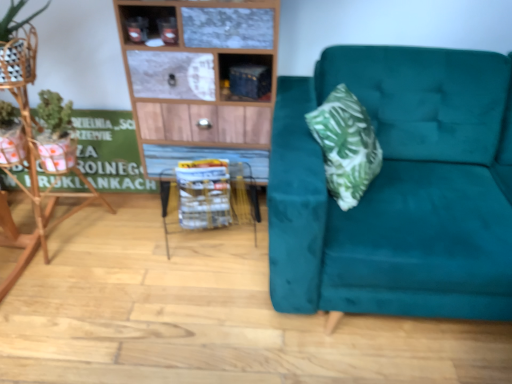
The height and width of the screenshot is (384, 512). Identify the location of vacant position to the left of teal velvet couch at right. (172, 293).